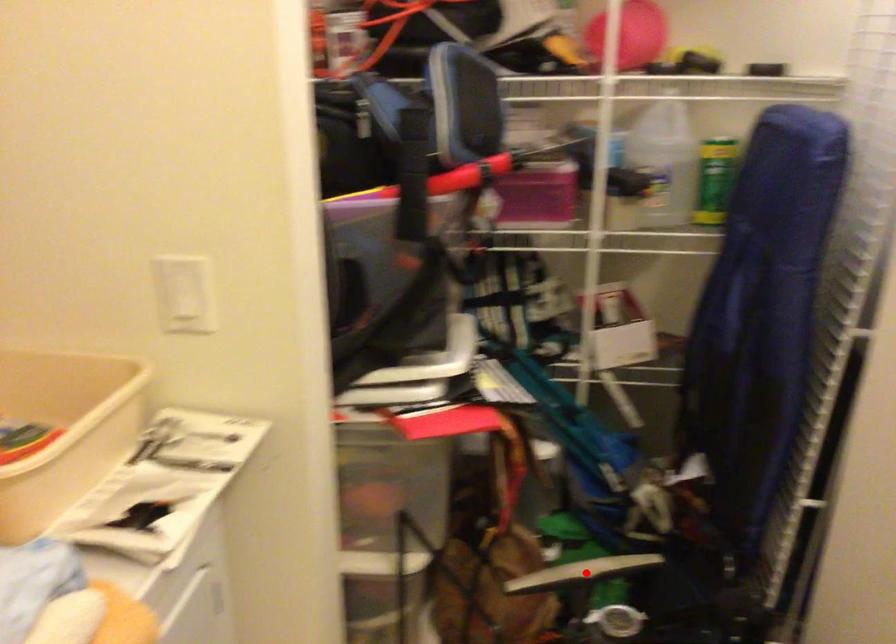
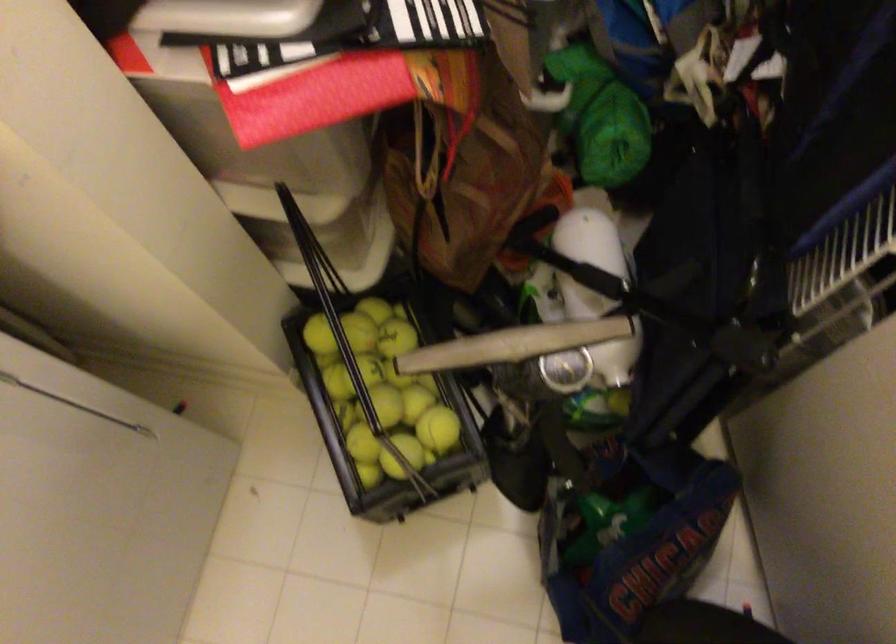
In the second image, find the point that corresponds to the highlighted location in the first image.

(513, 345)